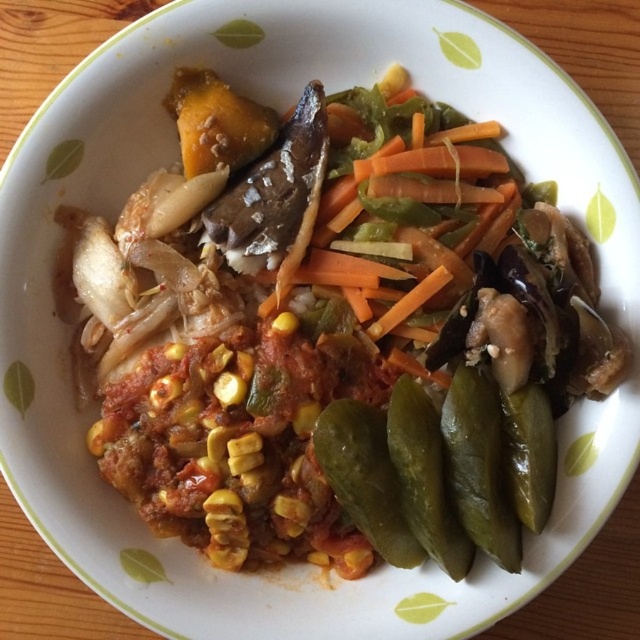
In the scene shown: You are a food delivery robot with a 4 inch wide tray. You need to place a napkin between the green glossy pickles at lower right and the green pickled vegetable at center. Can you fit the napkin between them?

The distance between the green glossy pickles at lower right and the green pickled vegetable at center is 5.24 inches. Since the napkin needs to fit within this space and your tray is 4 inches wide, there is enough space to place the napkin between them.

You are a food critic evaluating this dish. You notice a specific point marked at coordinates (477, 465) on the plate. What item is located at this point?

The point at coordinates (477, 465) marks green glossy pickles at lower right.